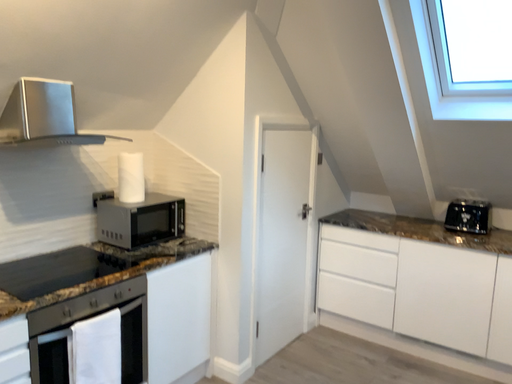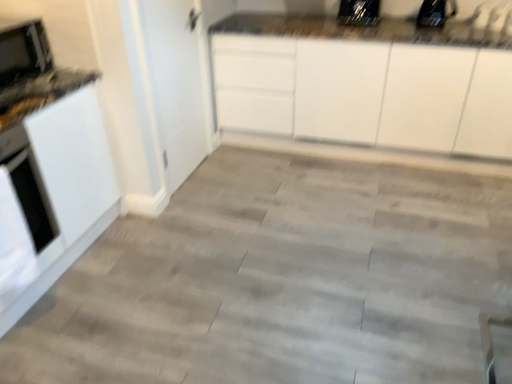
Question: Which way did the camera rotate in the video?

Choices:
 (A) rotated right
 (B) rotated left

Answer: (A)